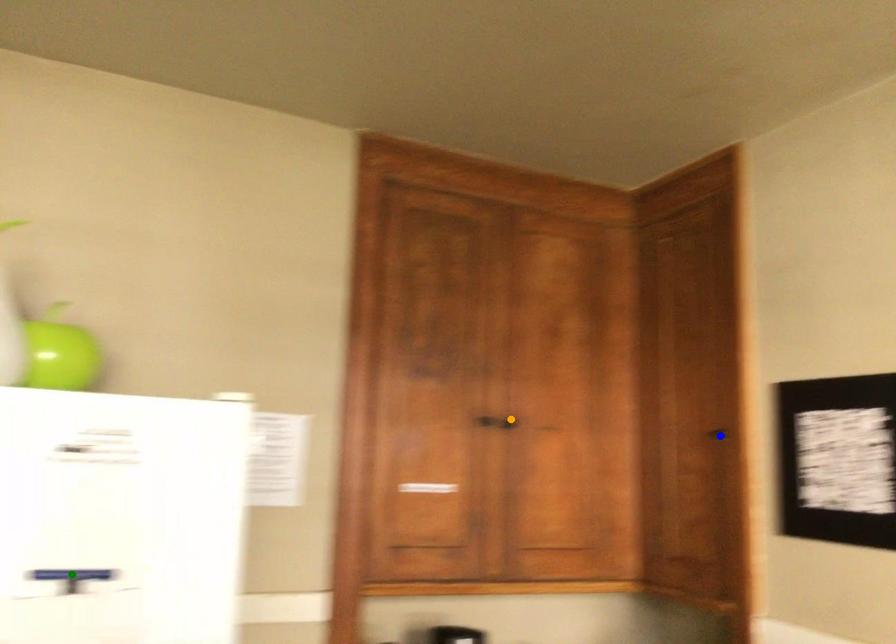
Order these from nearest to farthest:
blue point, green point, orange point

green point → blue point → orange point